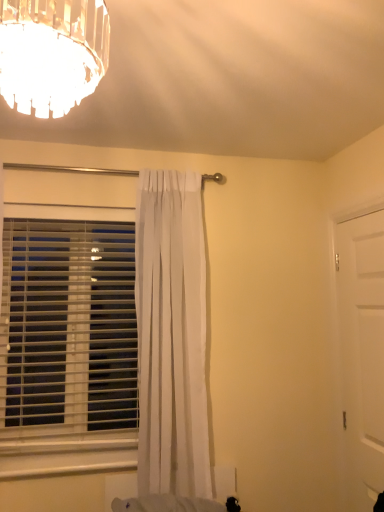
Question: From a real-world perspective, is white sheer curtain at center positioned under white plastic blinds at left based on gravity?

Choices:
 (A) yes
 (B) no

Answer: (B)

Question: From the image's perspective, does white sheer curtain at center appear lower than white plastic blinds at left?

Choices:
 (A) no
 (B) yes

Answer: (A)

Question: Is white sheer curtain at center not inside white plastic blinds at left?

Choices:
 (A) no
 (B) yes

Answer: (B)

Question: Is white sheer curtain at center to the left of white plastic blinds at left from the viewer's perspective?

Choices:
 (A) no
 (B) yes

Answer: (A)

Question: Does white sheer curtain at center appear on the right side of white plastic blinds at left?

Choices:
 (A) no
 (B) yes

Answer: (B)

Question: Can you confirm if white sheer curtain at center is taller than white plastic blinds at left?

Choices:
 (A) no
 (B) yes

Answer: (B)

Question: Is the depth of white matte door at right less than that of white plastic blinds at left?

Choices:
 (A) yes
 (B) no

Answer: (A)

Question: Is white matte door at right bigger than white plastic blinds at left?

Choices:
 (A) yes
 (B) no

Answer: (B)

Question: Is white matte door at right at the right side of white plastic blinds at left?

Choices:
 (A) yes
 (B) no

Answer: (A)

Question: Is white matte door at right facing away from white plastic blinds at left?

Choices:
 (A) no
 (B) yes

Answer: (A)

Question: Does white matte door at right turn towards white plastic blinds at left?

Choices:
 (A) yes
 (B) no

Answer: (A)

Question: From the image's perspective, is white matte door at right below white plastic blinds at left?

Choices:
 (A) yes
 (B) no

Answer: (A)

Question: Is white matte door at right touching white sheer curtain at center?

Choices:
 (A) yes
 (B) no

Answer: (B)